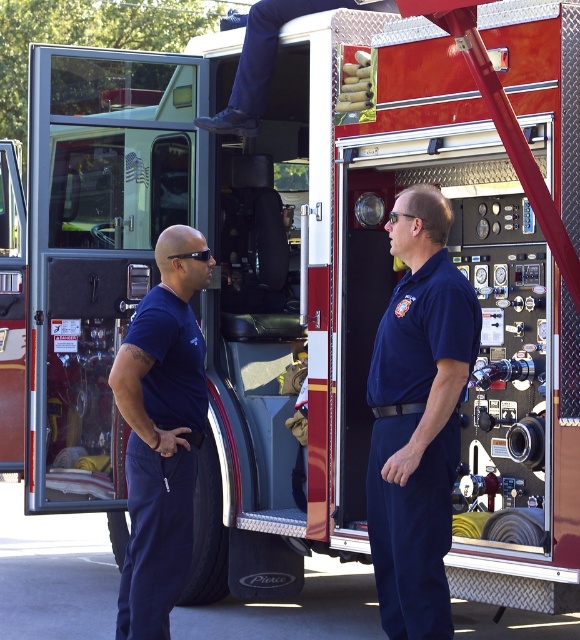
Looking at this image, is navy blue uniform at center closer to camera compared to dark blue uniform at center?

Yes, navy blue uniform at center is closer to the viewer.

Is navy blue uniform at center above dark blue uniform at center?

Yes, navy blue uniform at center is above dark blue uniform at center.

Does point (389, 538) come in front of point (175, 282)?

That is True.

In order to click on navy blue uniform at center in this screenshot , I will do `click(418, 419)`.